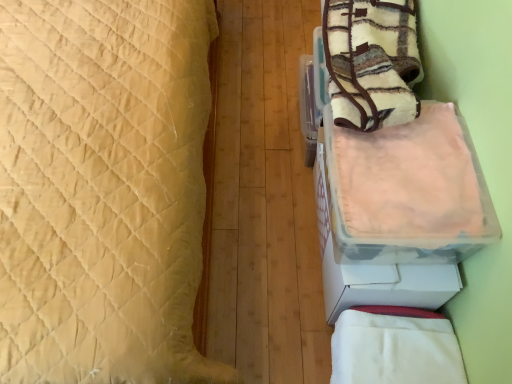
The height and width of the screenshot is (384, 512). In order to click on beige quilted bed at left in this screenshot , I will do `click(103, 190)`.

Measure the distance between point (454, 272) and camera.

3.33 feet.

The width and height of the screenshot is (512, 384). What do you see at coordinates (371, 62) in the screenshot? I see `fluffy fleece blanket at upper right, the 2th blanket ordered from the bottom` at bounding box center [371, 62].

Where is `white soft blanket at lower right, acting as the second blanket starting from the top`? This screenshot has width=512, height=384. white soft blanket at lower right, acting as the second blanket starting from the top is located at coordinates (395, 347).

You are a GUI agent. You are given a task and a screenshot of the screen. Output one action in this format:
    pyautogui.click(x=<x>, y=<y>)
    Task: Click on the beige quilted bed at left
    The image size is (512, 384).
    Given the screenshot: What is the action you would take?
    pyautogui.click(x=103, y=190)

From the image's perspective, relative to white soft blanket at lower right, acting as the 1th blanket starting from the bottom, is translucent plastic container at right above or below?

Clearly, from the image's perspective, translucent plastic container at right is above white soft blanket at lower right, acting as the 1th blanket starting from the bottom.

In the scene shown: Considering the sizes of translucent plastic container at right and white soft blanket at lower right, acting as the 1th blanket starting from the bottom, in the image, is translucent plastic container at right bigger or smaller than white soft blanket at lower right, acting as the 1th blanket starting from the bottom,?

Clearly, translucent plastic container at right is larger in size than white soft blanket at lower right, acting as the 1th blanket starting from the bottom.

Would you say translucent plastic container at right is outside white soft blanket at lower right, acting as the second blanket starting from the top?

Yes, translucent plastic container at right is outside of white soft blanket at lower right, acting as the second blanket starting from the top.

Visually, is translucent plastic container at right positioned to the left or to the right of white soft blanket at lower right, acting as the second blanket starting from the top?

Based on their positions, translucent plastic container at right is located to the left of white soft blanket at lower right, acting as the second blanket starting from the top.

Does point (398, 347) lie behind point (325, 206)?

No, it is in front of (325, 206).

Is white soft blanket at lower right, acting as the 1th blanket starting from the bottom, bigger or smaller than translucent plastic container at right?

Considering their sizes, white soft blanket at lower right, acting as the 1th blanket starting from the bottom, takes up less space than translucent plastic container at right.

From a real-world perspective, which object rests below the other?

In real-world perspective, white soft blanket at lower right, acting as the 1th blanket starting from the bottom, is lower.

Is white soft blanket at lower right, acting as the 1th blanket starting from the bottom, facing towards translucent plastic container at right?

No, white soft blanket at lower right, acting as the 1th blanket starting from the bottom, does not turn towards translucent plastic container at right.

Which is more to the left, fluffy fleece blanket at upper right, the 2th blanket ordered from the bottom, or beige quilted bed at left?

beige quilted bed at left.

Is fluffy fleece blanket at upper right, the 2th blanket ordered from the bottom, oriented away from beige quilted bed at left?

That's not correct — fluffy fleece blanket at upper right, the 2th blanket ordered from the bottom, is not looking away from beige quilted bed at left.

Is fluffy fleece blanket at upper right, the 1th blanket positioned from the top, with beige quilted bed at left?

No, fluffy fleece blanket at upper right, the 1th blanket positioned from the top, is not beside beige quilted bed at left.

Find the location of a particular element. The image size is (512, 384). blanket located above the beige quilted bed at left (from the image's perspective) is located at coordinates (371, 62).

Would you say translucent plastic container at right is outside beige quilted bed at left?

Yes, translucent plastic container at right is not within beige quilted bed at left.

Considering the points (332, 264) and (77, 329), which point is behind, point (332, 264) or point (77, 329)?

The point (332, 264) is farther from the camera.

Considering the sizes of translucent plastic container at right and beige quilted bed at left in the image, is translucent plastic container at right wider or thinner than beige quilted bed at left?

translucent plastic container at right is thinner than beige quilted bed at left.

From a real-world perspective, is translucent plastic container at right positioned over beige quilted bed at left based on gravity?

No, from a real-world perspective, translucent plastic container at right is not above beige quilted bed at left.

From a real-world perspective, is white soft blanket at lower right, acting as the second blanket starting from the top, physically located above or below beige quilted bed at left?

white soft blanket at lower right, acting as the second blanket starting from the top, is below beige quilted bed at left.

Considering the sizes of white soft blanket at lower right, acting as the second blanket starting from the top, and beige quilted bed at left in the image, is white soft blanket at lower right, acting as the second blanket starting from the top, wider or thinner than beige quilted bed at left?

In the image, white soft blanket at lower right, acting as the second blanket starting from the top, appears to be more narrow than beige quilted bed at left.

Can you confirm if white soft blanket at lower right, acting as the second blanket starting from the top, is shorter than beige quilted bed at left?

Yes.

Is white soft blanket at lower right, acting as the 1th blanket starting from the bottom, facing away from beige quilted bed at left?

No.

Is fluffy fleece blanket at upper right, the 1th blanket positioned from the top, in contact with white soft blanket at lower right, acting as the second blanket starting from the top?

No, fluffy fleece blanket at upper right, the 1th blanket positioned from the top, is not next to white soft blanket at lower right, acting as the second blanket starting from the top.

Is fluffy fleece blanket at upper right, the 1th blanket positioned from the top, turned away from white soft blanket at lower right, acting as the second blanket starting from the top?

fluffy fleece blanket at upper right, the 1th blanket positioned from the top, is not turned away from white soft blanket at lower right, acting as the second blanket starting from the top.

Between fluffy fleece blanket at upper right, the 2th blanket ordered from the bottom, and white soft blanket at lower right, acting as the second blanket starting from the top, which one appears on the right side from the viewer's perspective?

fluffy fleece blanket at upper right, the 2th blanket ordered from the bottom.

Is fluffy fleece blanket at upper right, the 1th blanket positioned from the top, thinner than white soft blanket at lower right, acting as the second blanket starting from the top?

No, fluffy fleece blanket at upper right, the 1th blanket positioned from the top, is not thinner than white soft blanket at lower right, acting as the second blanket starting from the top.

Is beige quilted bed at left facing away from fluffy fleece blanket at upper right, the 2th blanket ordered from the bottom?

No, beige quilted bed at left's orientation is not away from fluffy fleece blanket at upper right, the 2th blanket ordered from the bottom.

From a real-world perspective, is beige quilted bed at left on fluffy fleece blanket at upper right, the 1th blanket positioned from the top?

No, from a real-world perspective, beige quilted bed at left is not above fluffy fleece blanket at upper right, the 1th blanket positioned from the top.

Between point (124, 357) and point (368, 119), which one is positioned behind?

The point (368, 119) is behind.

Find the location of a particular element. The height and width of the screenshot is (384, 512). cardboard box above the white soft blanket at lower right, acting as the 1th blanket starting from the bottom (from the image's perspective) is located at coordinates (399, 210).

At what (x,y) coordinates should I click in order to perform the action: click on the 1st blanket to the right of the translucent plastic container at right, counting from the anchor's position. Please return your answer as a coordinate pair (x, y). Looking at the image, I should click on (395, 347).

When comparing their distances from fluffy fleece blanket at upper right, the 1th blanket positioned from the top, does translucent plastic container at right or white soft blanket at lower right, acting as the 1th blanket starting from the bottom, seem closer?

Based on the image, translucent plastic container at right appears to be nearer to fluffy fleece blanket at upper right, the 1th blanket positioned from the top.

When comparing their distances from white soft blanket at lower right, acting as the 1th blanket starting from the bottom, does fluffy fleece blanket at upper right, the 1th blanket positioned from the top, or translucent plastic container at right seem further?

fluffy fleece blanket at upper right, the 1th blanket positioned from the top, lies further to white soft blanket at lower right, acting as the 1th blanket starting from the bottom, than the other object.

Which object lies further to the anchor point beige quilted bed at left, translucent plastic container at right or white soft blanket at lower right, acting as the second blanket starting from the top?

white soft blanket at lower right, acting as the second blanket starting from the top, lies further to beige quilted bed at left than the other object.

Which object lies further to the anchor point fluffy fleece blanket at upper right, the 2th blanket ordered from the bottom, translucent plastic container at right or beige quilted bed at left?

beige quilted bed at left is positioned further to the anchor fluffy fleece blanket at upper right, the 2th blanket ordered from the bottom.

From the picture: Which object lies further to the anchor point white soft blanket at lower right, acting as the 1th blanket starting from the bottom, fluffy fleece blanket at upper right, the 1th blanket positioned from the top, or beige quilted bed at left?

Among the two, beige quilted bed at left is located further to white soft blanket at lower right, acting as the 1th blanket starting from the bottom.

From the image, which object appears to be nearer to fluffy fleece blanket at upper right, the 2th blanket ordered from the bottom, white soft blanket at lower right, acting as the 1th blanket starting from the bottom, or beige quilted bed at left?

The object closer to fluffy fleece blanket at upper right, the 2th blanket ordered from the bottom, is beige quilted bed at left.

Estimate the real-world distances between objects in this image. Which object is further from translucent plastic container at right, white soft blanket at lower right, acting as the second blanket starting from the top, or fluffy fleece blanket at upper right, the 2th blanket ordered from the bottom?

The object further to translucent plastic container at right is fluffy fleece blanket at upper right, the 2th blanket ordered from the bottom.

Based on their spatial positions, is beige quilted bed at left or fluffy fleece blanket at upper right, the 1th blanket positioned from the top, closer to translucent plastic container at right?

The object closer to translucent plastic container at right is fluffy fleece blanket at upper right, the 1th blanket positioned from the top.

You are a GUI agent. You are given a task and a screenshot of the screen. Output one action in this format:
    pyautogui.click(x=<x>, y=<y>)
    Task: Click on the cardboard box located between beige quilted bed at left and fluffy fleece blanket at upper right, the 2th blanket ordered from the bottom, in the left-right direction
    The image size is (512, 384).
    Given the screenshot: What is the action you would take?
    399,210

At what (x,y) coordinates should I click in order to perform the action: click on cardboard box located between beige quilted bed at left and white soft blanket at lower right, acting as the second blanket starting from the top, in the left-right direction. Please return your answer as a coordinate pair (x, y). Image resolution: width=512 pixels, height=384 pixels. Looking at the image, I should click on (399, 210).

Where is `blanket between beige quilted bed at left and fluffy fleece blanket at upper right, the 1th blanket positioned from the top, from left to right`? This screenshot has width=512, height=384. blanket between beige quilted bed at left and fluffy fleece blanket at upper right, the 1th blanket positioned from the top, from left to right is located at coordinates (395, 347).

Locate an element on the screen. cardboard box between fluffy fleece blanket at upper right, the 2th blanket ordered from the bottom, and white soft blanket at lower right, acting as the 1th blanket starting from the bottom, from top to bottom is located at coordinates (399, 210).